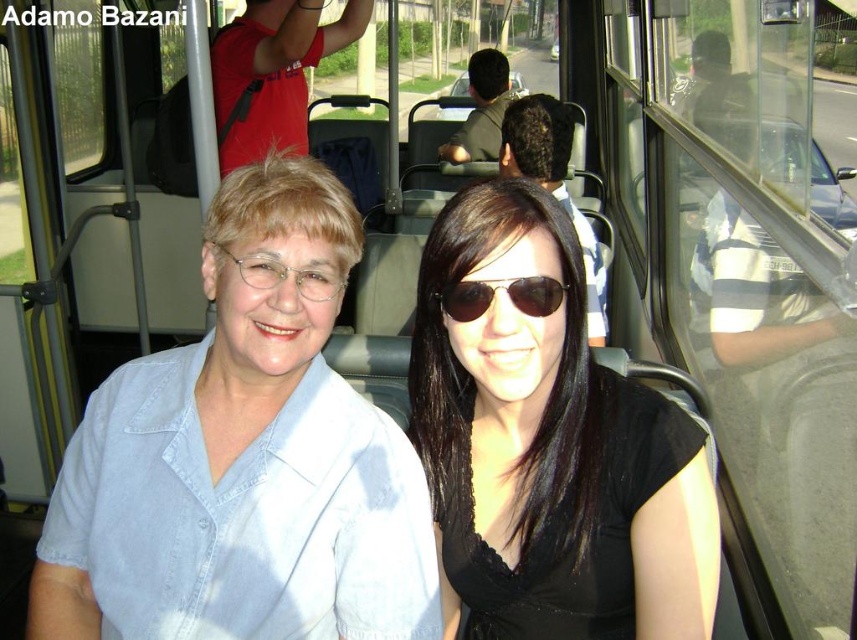
Question: Which object appears farthest from the camera in this image?

Choices:
 (A) black matte sunglasses at center
 (B) dark brown hair at center

Answer: (B)

Question: Can you confirm if black matte sunglasses at center is positioned above dark brown leather jacket at center?

Choices:
 (A) yes
 (B) no

Answer: (B)

Question: Is denim shirt at center to the left of sunglasses at center from the viewer's perspective?

Choices:
 (A) no
 (B) yes

Answer: (B)

Question: Which is farther from the dark brown leather jacket at center?

Choices:
 (A) sunglasses at center
 (B) black matte sunglasses at center
 (C) dark brown hair at center
 (D) denim shirt at center

Answer: (A)

Question: Does denim shirt at center appear on the right side of black matte sunglasses at center?

Choices:
 (A) no
 (B) yes

Answer: (A)

Question: Which object is the closest to the dark brown hair at center?

Choices:
 (A) denim shirt at center
 (B) sunglasses at center

Answer: (A)